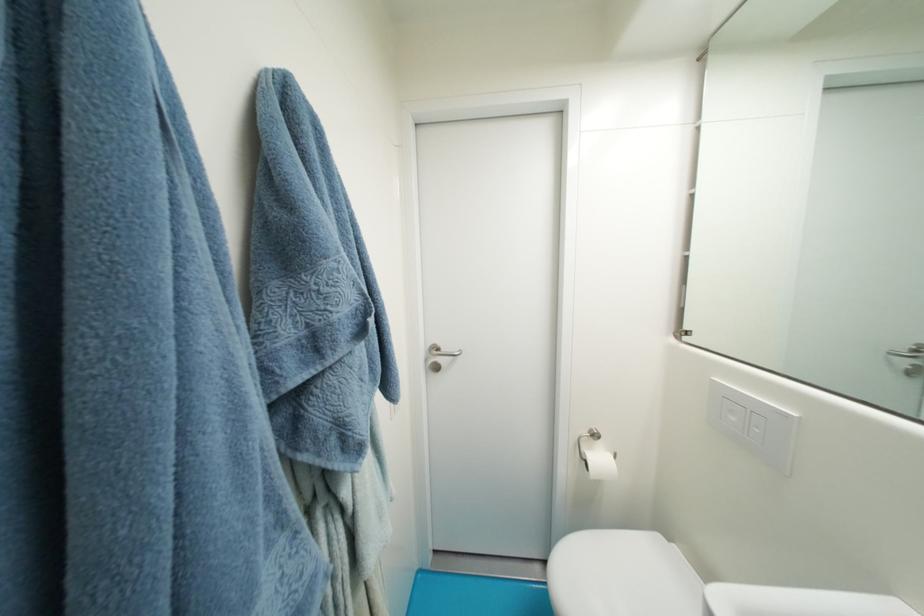
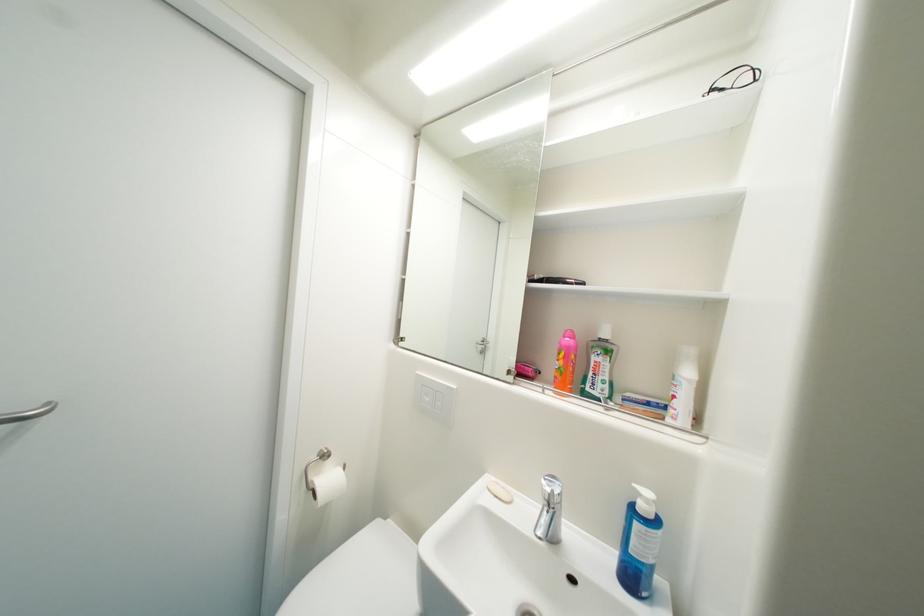
In the second image, find the point that corresponds to point (691, 339) in the first image.

(407, 345)